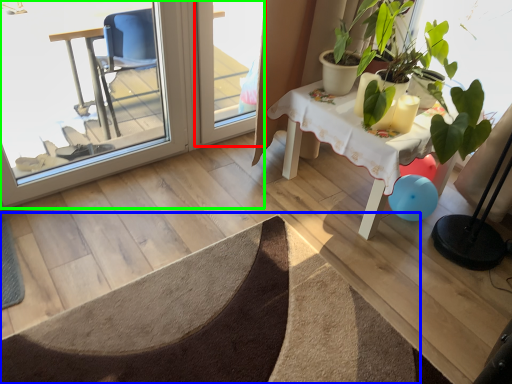
Question: Considering the real-world distances, which object is closest to screen door (highlighted by a red box)? doormat (highlighted by a blue box) or screen door (highlighted by a green box).

Choices:
 (A) doormat
 (B) screen door

Answer: (B)